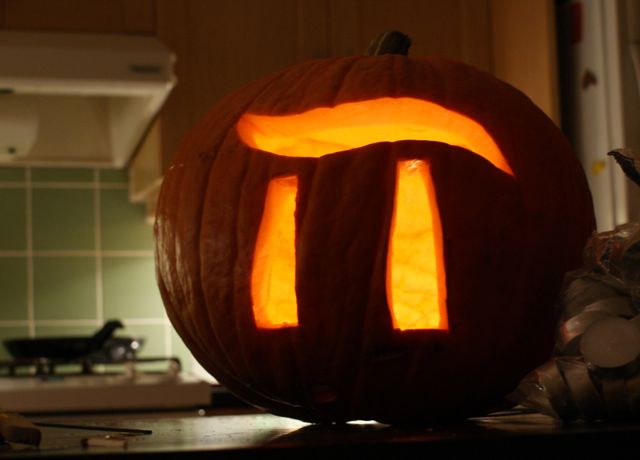
Where is `tile backsplash`? This screenshot has width=640, height=460. tile backsplash is located at coordinates (76, 278).